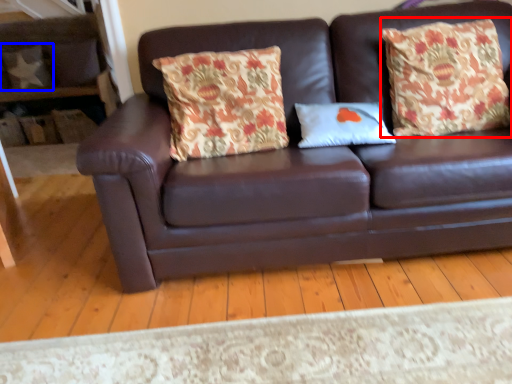
Question: Among these objects, which one is farthest to the camera, throw pillow (highlighted by a red box) or pillow (highlighted by a blue box)?

Choices:
 (A) throw pillow
 (B) pillow

Answer: (B)